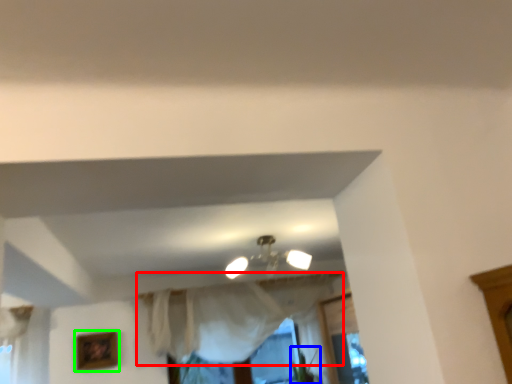
Question: Considering the real-world distances, which object is closest to curtain (highlighted by a red box)? plant (highlighted by a blue box) or picture frame (highlighted by a green box).

Choices:
 (A) plant
 (B) picture frame

Answer: (A)